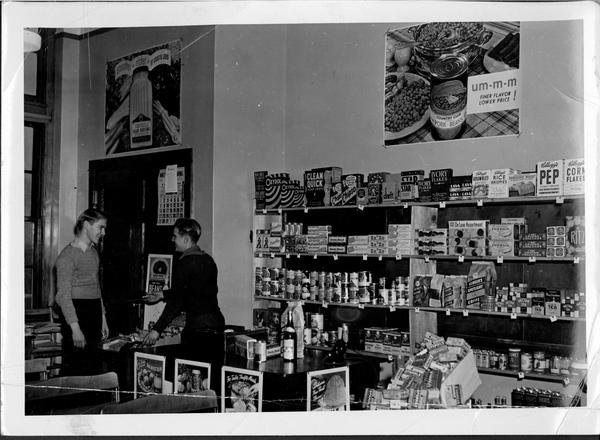
Where is `chair`? The image size is (600, 440). chair is located at coordinates (126, 406).